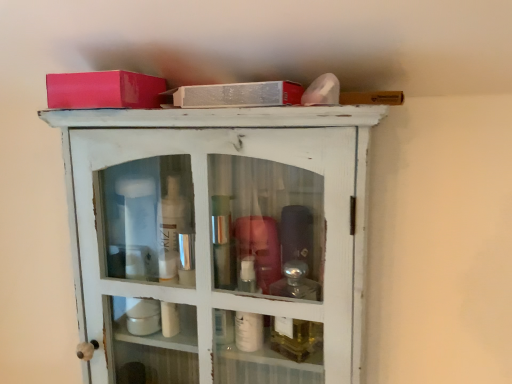
Question: Is the surface of white distressed wood cabinet at upper center in direct contact with matte pink box at upper left?

Choices:
 (A) no
 (B) yes

Answer: (A)

Question: Can you confirm if white distressed wood cabinet at upper center is positioned to the left of matte pink box at upper left?

Choices:
 (A) yes
 (B) no

Answer: (B)

Question: Is white distressed wood cabinet at upper center positioned with its back to matte pink box at upper left?

Choices:
 (A) no
 (B) yes

Answer: (A)

Question: Is white distressed wood cabinet at upper center thinner than matte pink box at upper left?

Choices:
 (A) yes
 (B) no

Answer: (B)

Question: From the image's perspective, is white distressed wood cabinet at upper center below matte pink box at upper left?

Choices:
 (A) no
 (B) yes

Answer: (B)

Question: Is white distressed wood cabinet at upper center positioned beyond the bounds of matte pink box at upper left?

Choices:
 (A) no
 (B) yes

Answer: (B)

Question: From the image's perspective, is matte pink box at upper left above white distressed wood cabinet at upper center?

Choices:
 (A) yes
 (B) no

Answer: (A)

Question: From a real-world perspective, is matte pink box at upper left physically below white distressed wood cabinet at upper center?

Choices:
 (A) no
 (B) yes

Answer: (A)

Question: Does matte pink box at upper left have a smaller size compared to white distressed wood cabinet at upper center?

Choices:
 (A) no
 (B) yes

Answer: (B)

Question: Does matte pink box at upper left have a lesser height compared to white distressed wood cabinet at upper center?

Choices:
 (A) yes
 (B) no

Answer: (A)

Question: Does matte pink box at upper left have a lesser width compared to white distressed wood cabinet at upper center?

Choices:
 (A) yes
 (B) no

Answer: (A)

Question: Is matte pink box at upper left bigger than white distressed wood cabinet at upper center?

Choices:
 (A) yes
 (B) no

Answer: (B)

Question: Would you say matte pink box at upper left is inside or outside white distressed wood cabinet at upper center?

Choices:
 (A) outside
 (B) inside

Answer: (A)